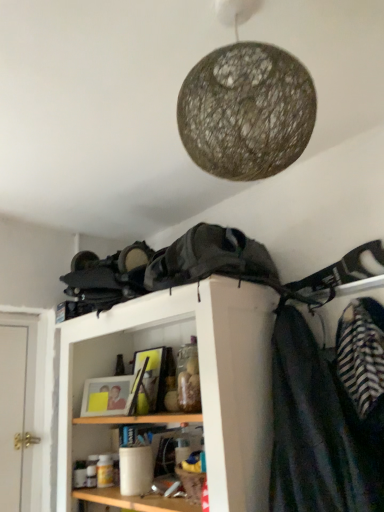
Question: From the image's perspective, relative to wooden shelf at center, is striped fabric at right above or below?

Choices:
 (A) above
 (B) below

Answer: (A)

Question: Is point (352, 438) positioned closer to the camera than point (104, 312)?

Choices:
 (A) farther
 (B) closer

Answer: (B)

Question: Considering the real-world distances, which object is closest to the striped fabric at right?

Choices:
 (A) wooden shelf at center
 (B) woven natural fiber lampshade at upper center

Answer: (A)

Question: Estimate the real-world distances between objects in this image. Which object is farther from the striped fabric at right?

Choices:
 (A) wooden shelf at center
 (B) woven natural fiber lampshade at upper center

Answer: (B)